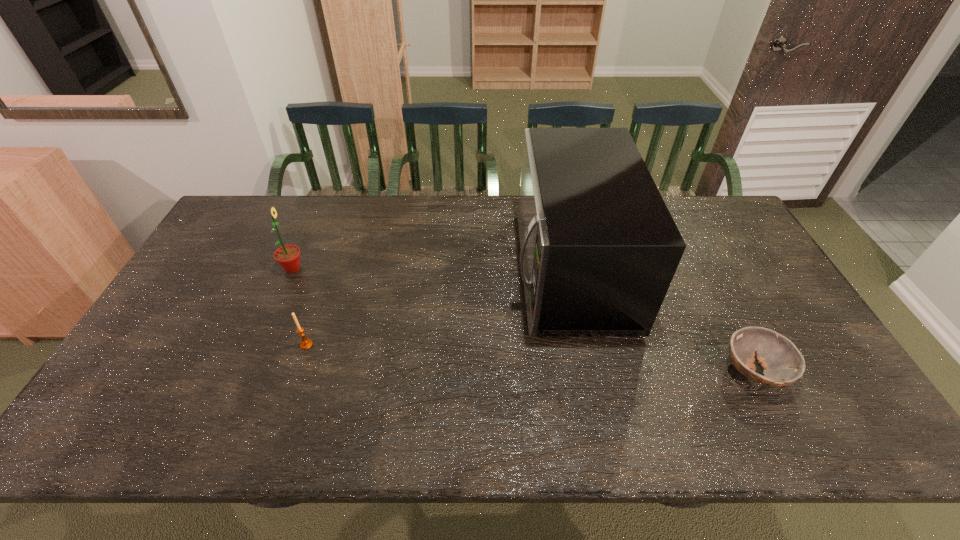
Locate an element on the screen. Image resolution: width=960 pixels, height=540 pixels. the tallest object is located at coordinates (599, 248).

The image size is (960, 540). Find the location of `the second object from right to left`. the second object from right to left is located at coordinates (599, 248).

You are a GUI agent. You are given a task and a screenshot of the screen. Output one action in this format:
    pyautogui.click(x=<x>, y=<y>)
    Task: Click on the sunflower
    Image resolution: width=960 pixels, height=540 pixels.
    Given the screenshot: What is the action you would take?
    click(x=288, y=256)

You are a GUI agent. You are given a task and a screenshot of the screen. Output one action in this format:
    pyautogui.click(x=<x>, y=<y>)
    Task: Click on the leftmost object
    This screenshot has height=540, width=960.
    Given the screenshot: What is the action you would take?
    [288, 256]

The width and height of the screenshot is (960, 540). Find the location of `the third object from right to left`. the third object from right to left is located at coordinates (306, 343).

This screenshot has width=960, height=540. Identify the location of the second shortest object. (306, 343).

Where is `bowl`? bowl is located at coordinates (783, 364).

At what (x,y) coordinates should I click in order to perform the action: click on the shortest object. Please return your answer as a coordinate pair (x, y). Looking at the image, I should click on (783, 364).

At what (x,y) coordinates should I click in order to perform the action: click on vacant region located 0.100m with the door open on the third object from left to right. Please return your answer as a coordinate pair (x, y). Looking at the image, I should click on (481, 269).

The image size is (960, 540). I want to click on vacant space located 0.110m with the door open on the third object from left to right, so click(478, 269).